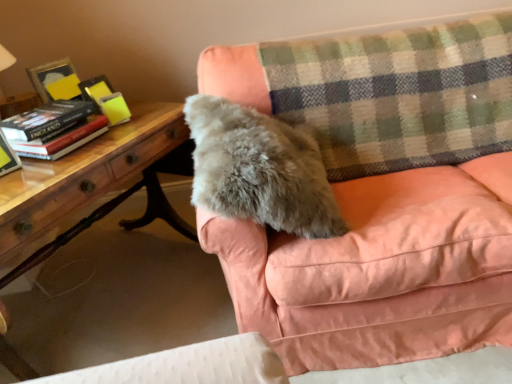
Question: In terms of height, does wooden table at left look taller or shorter compared to gray furry pillow at center?

Choices:
 (A) tall
 (B) short

Answer: (A)

Question: Is wooden table at left bigger or smaller than gray furry pillow at center?

Choices:
 (A) big
 (B) small

Answer: (A)

Question: Which object is positioned farthest from the soft pink fabric couch at upper right?

Choices:
 (A) hardcover book at left
 (B) gray furry pillow at center
 (C) wooden table at left
 (D) green plaid blanket at upper right
 (E) hardcover book at left

Answer: (A)

Question: Which is farther from the green plaid blanket at upper right?

Choices:
 (A) gray furry pillow at center
 (B) hardcover book at left
 (C) hardcover book at left
 (D) soft pink fabric couch at upper right
 (E) wooden table at left

Answer: (B)